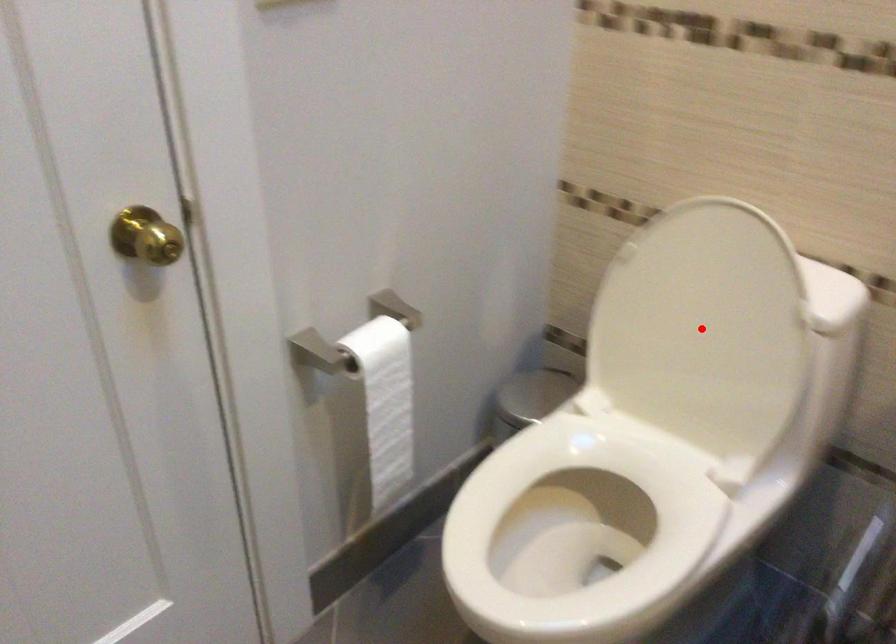
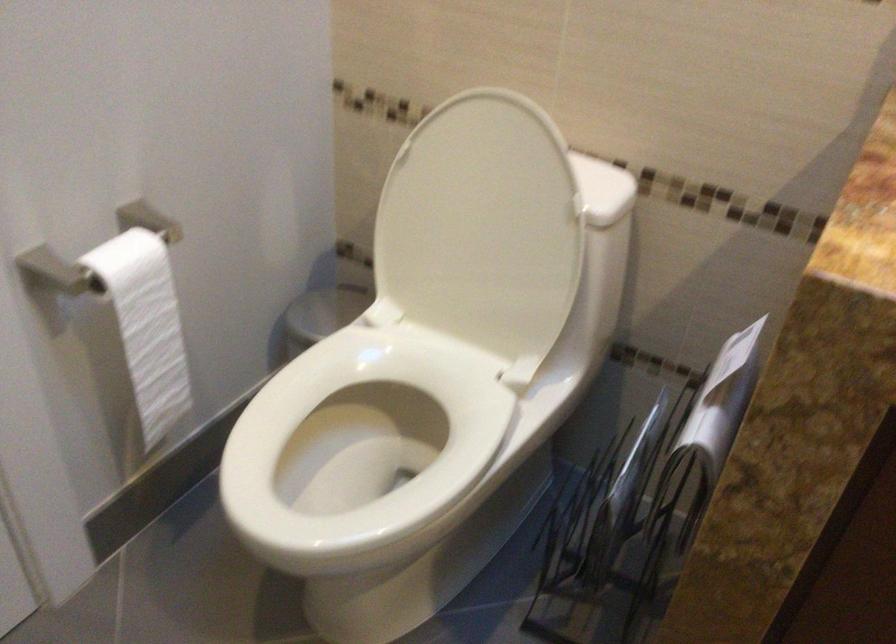
Locate, in the second image, the point that corresponds to the highlighted location in the first image.

(483, 228)